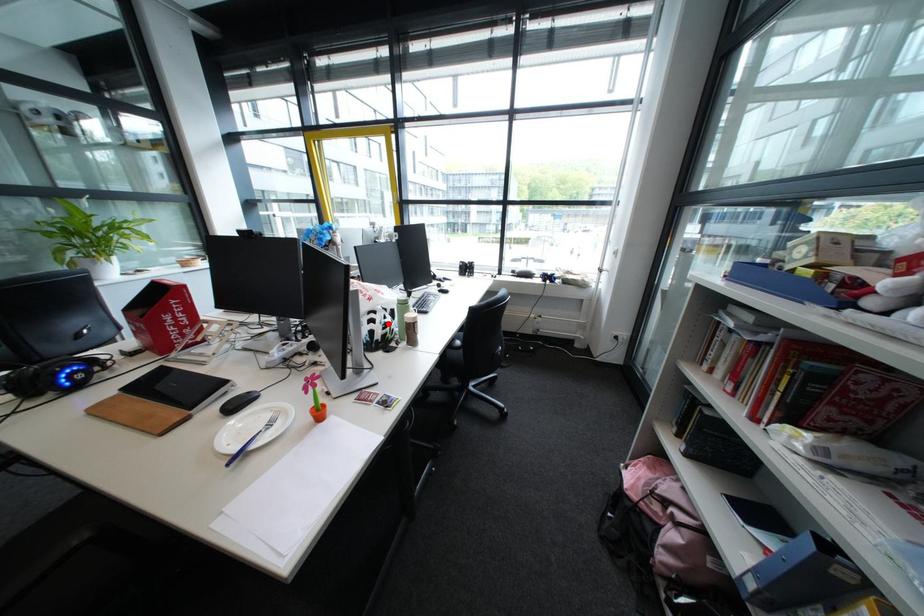
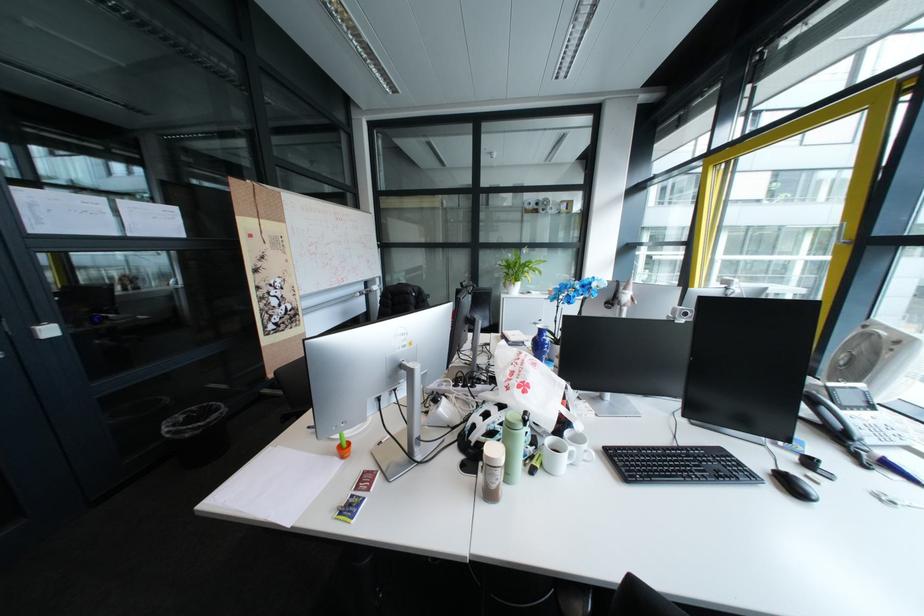
Find the pixel in the second image that matches the highlighted location in the first image.

(497, 421)